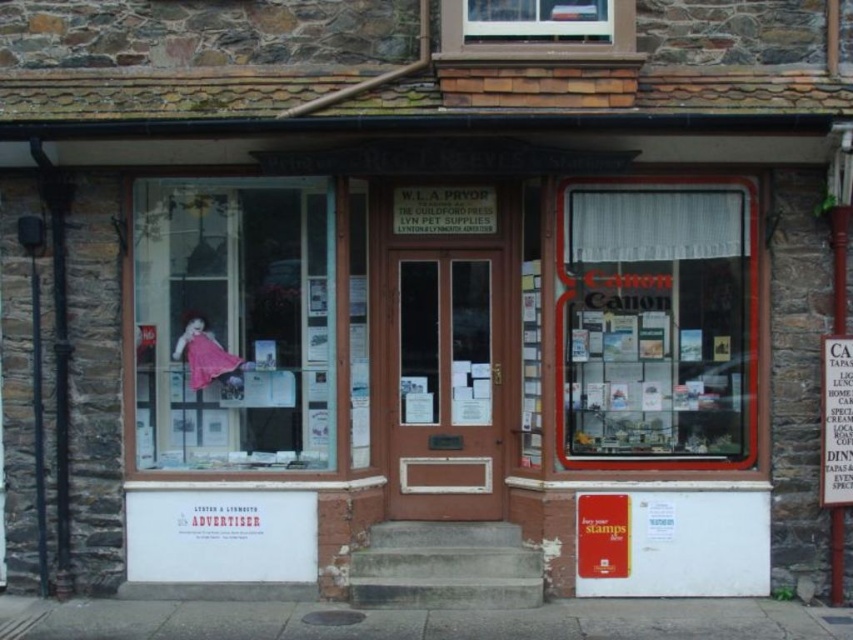
You are a customer standing in front of the storefront. You want to read the metallic silver sign at right but find it difficult to see because of glare from the clear glass window at center. Which object is causing the glare, and why?

The clear glass window at center is causing the glare because it is much taller than the metallic silver sign at right, making it more likely to reflect light and obscure visibility.

You are a delivery person approaching the storefront and need to check the address on the clear glass window at center and the clear glass window at upper center. Which window should you look at first if you want to check the one that is bigger?

The clear glass window at center is larger than the clear glass window at upper center, so you should look at the clear glass window at center first.

You are standing in front of the quaint traditional building with a stone facade. You notice a clear glass window at center located at point (656, 323). Can you determine if this window is part of the storefront area described in the scene?

The clear glass window at center located at point (656, 323) is part of the storefront area as it is positioned at the center of the building, which is where the storefront is described to be.